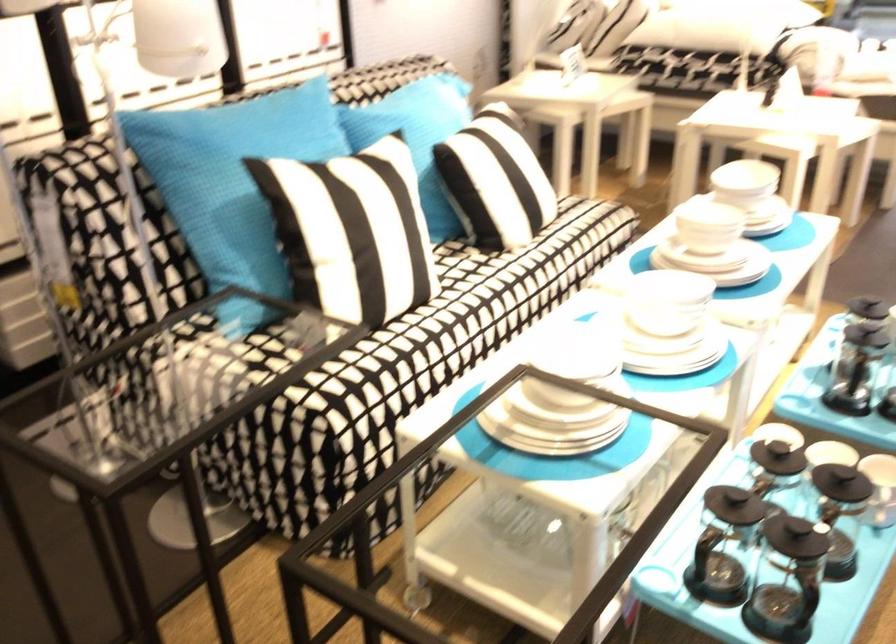
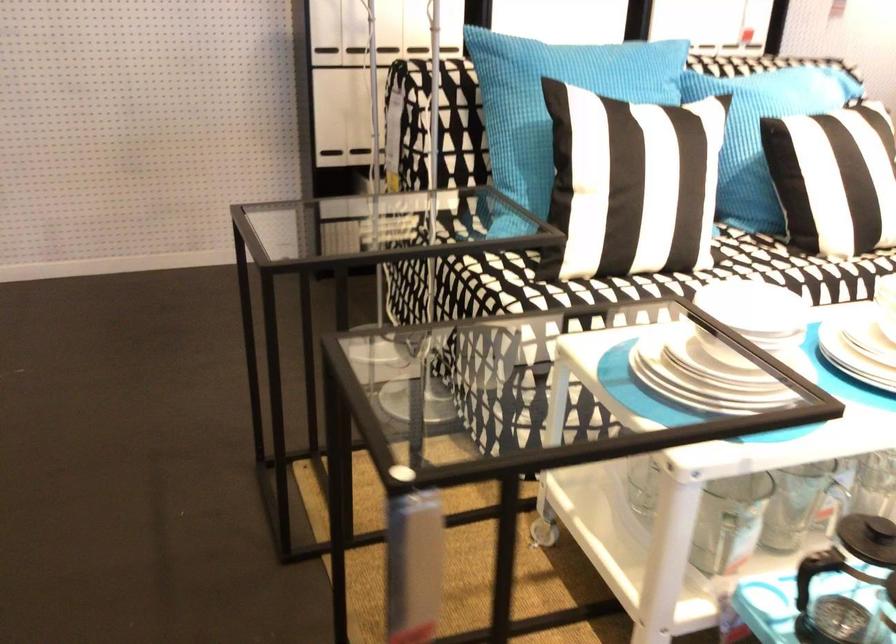
The point at (504,187) is marked in the first image. Where is the corresponding point in the second image?

(833, 178)